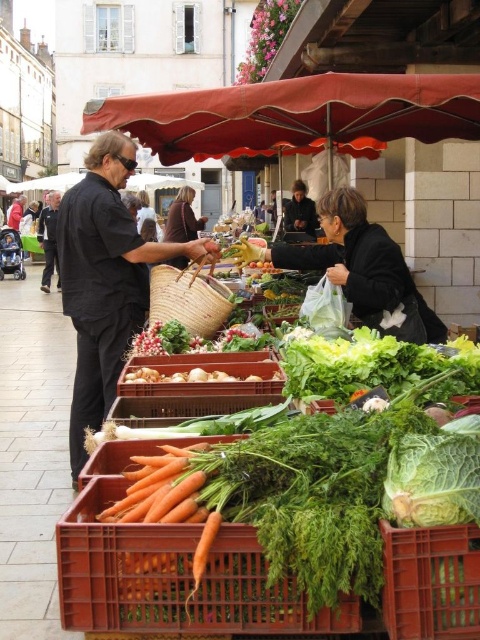
Question: Which object appears closest to the camera in this image?

Choices:
 (A) smooth black jacket at center
 (B) orange plastic crate of carrots at center
 (C) green plastic crate at lower center

Answer: (C)

Question: Among these points, which one is farthest from the camera?

Choices:
 (A) (91, 180)
 (B) (204, 337)
 (C) (298, 212)

Answer: (C)

Question: Based on their relative distances, which object is farther from the black fabric shirt at left?

Choices:
 (A) woven straw basket at center
 (B) dark gray suit at center
 (C) smooth black jacket at center

Answer: (B)

Question: Can you confirm if dark gray suit at center is positioned to the right of smooth black jacket at center?

Choices:
 (A) yes
 (B) no

Answer: (B)

Question: Does orange plastic crate of carrots at center have a lesser width compared to brown leather jacket at center?

Choices:
 (A) yes
 (B) no

Answer: (A)

Question: Is black fabric bag at center to the right of green plastic crate at lower center from the viewer's perspective?

Choices:
 (A) yes
 (B) no

Answer: (B)